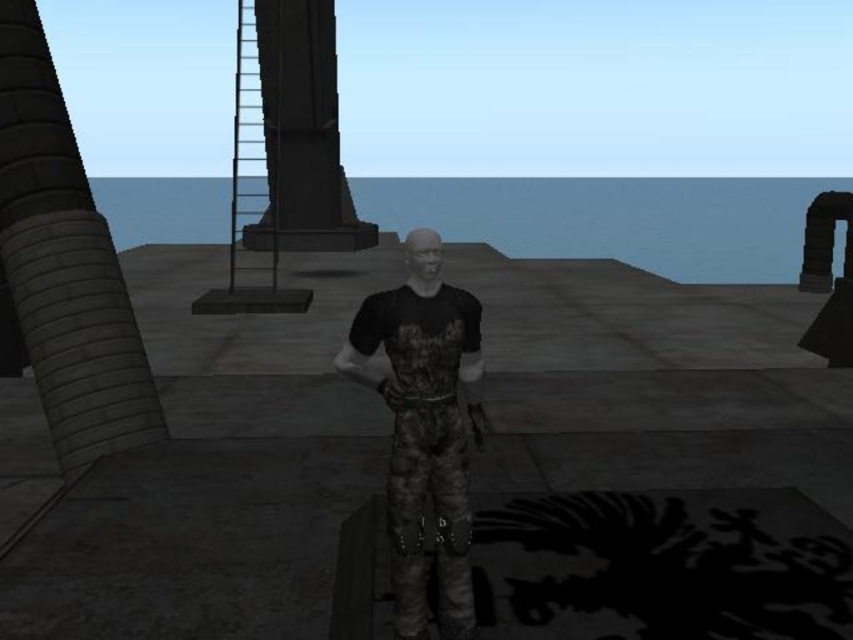
Is gray concrete pillar at left above black stone pillar at upper center?

No.

Who is higher up, gray concrete pillar at left or black stone pillar at upper center?

Positioned higher is black stone pillar at upper center.

Find the location of `gray concrete pillar at left`. gray concrete pillar at left is located at coordinates (64, 264).

Locate an element on the screen. This screenshot has width=853, height=640. gray concrete pillar at left is located at coordinates (64, 264).

Does camouflage pants at center appear on the left side of black stone pillar at upper center?

In fact, camouflage pants at center is to the right of black stone pillar at upper center.

Is camouflage pants at center to the right of black stone pillar at upper center from the viewer's perspective?

Yes, camouflage pants at center is to the right of black stone pillar at upper center.

Which is behind, point (422, 621) or point (322, 93)?

The point (322, 93) is behind.

Where is `camouflage pants at center`? Image resolution: width=853 pixels, height=640 pixels. camouflage pants at center is located at coordinates (424, 429).

Is gray concrete pillar at left bigger than camouflage pants at center?

Yes, gray concrete pillar at left is bigger than camouflage pants at center.

At what (x,y) coordinates should I click in order to perform the action: click on gray concrete pillar at left. Please return your answer as a coordinate pair (x, y). This screenshot has width=853, height=640. Looking at the image, I should click on (64, 264).

Find the location of `gray concrete pillar at left`. gray concrete pillar at left is located at coordinates (64, 264).